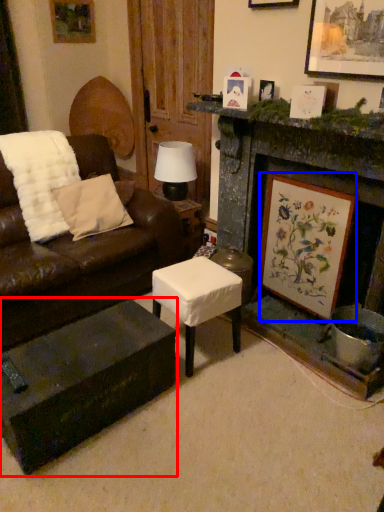
Question: Which object appears farthest to the camera in this image, coffee table (highlighted by a red box) or picture frame (highlighted by a blue box)?

Choices:
 (A) coffee table
 (B) picture frame

Answer: (B)